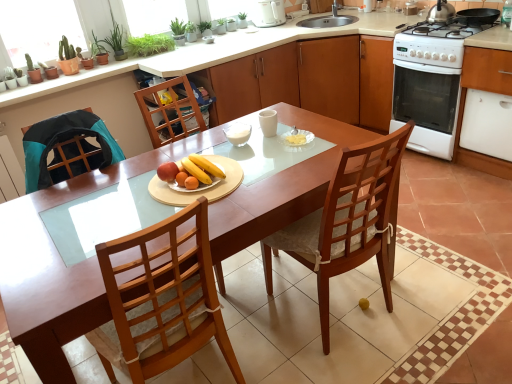
The width and height of the screenshot is (512, 384). In order to click on free point to the right of wooden table at center in this screenshot , I will do `click(438, 269)`.